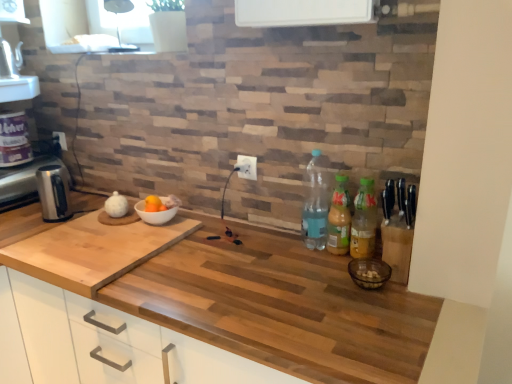
Question: From a real-world perspective, is white plastic electric outlet at upper center, the 1th electric outlet positioned from the left, physically above white plastic electric outlet at center, the second electric outlet positioned from the left?

Choices:
 (A) no
 (B) yes

Answer: (A)

Question: Does white plastic electric outlet at upper center, which is the second electric outlet from right to left, have a lesser width compared to white plastic electric outlet at center, the second electric outlet positioned from the back?

Choices:
 (A) yes
 (B) no

Answer: (B)

Question: Is white plastic electric outlet at upper center, the 1th electric outlet positioned from the left, shorter than white plastic electric outlet at center, the second electric outlet positioned from the left?

Choices:
 (A) yes
 (B) no

Answer: (A)

Question: From the image's perspective, is white plastic electric outlet at upper center, marked as the first electric outlet in a back-to-front arrangement, on white plastic electric outlet at center, arranged as the first electric outlet when viewed from the right?

Choices:
 (A) no
 (B) yes

Answer: (B)

Question: Is white plastic electric outlet at upper center, which is the second electric outlet from right to left, touching white plastic electric outlet at center, which is the second electric outlet from top to bottom?

Choices:
 (A) no
 (B) yes

Answer: (A)

Question: Considering the positions of translucent plastic bottle at right, which is the third bottle in right-to-left order, and satin silver kettle at left in the image, is translucent plastic bottle at right, which is the third bottle in right-to-left order, bigger or smaller than satin silver kettle at left?

Choices:
 (A) small
 (B) big

Answer: (A)

Question: Considering the relative positions of translucent plastic bottle at right, which ranks as the 1th bottle in left-to-right order, and satin silver kettle at left in the image provided, is translucent plastic bottle at right, which ranks as the 1th bottle in left-to-right order, to the left or to the right of satin silver kettle at left?

Choices:
 (A) right
 (B) left

Answer: (A)

Question: Is translucent plastic bottle at right, which ranks as the 1th bottle in left-to-right order, taller or shorter than satin silver kettle at left?

Choices:
 (A) tall
 (B) short

Answer: (A)

Question: From a real-world perspective, is translucent plastic bottle at right, which ranks as the 1th bottle in left-to-right order, positioned above or below satin silver kettle at left?

Choices:
 (A) below
 (B) above

Answer: (B)

Question: From the image's perspective, is satin silver kettle at left above or below satin silver kettle at left?

Choices:
 (A) above
 (B) below

Answer: (A)

Question: In terms of width, does satin silver kettle at left look wider or thinner when compared to satin silver kettle at left?

Choices:
 (A) thin
 (B) wide

Answer: (B)

Question: Is satin silver kettle at left to the left or to the right of satin silver kettle at left in the image?

Choices:
 (A) right
 (B) left

Answer: (B)

Question: In the image, is satin silver kettle at left positioned in front of or behind satin silver kettle at left?

Choices:
 (A) behind
 (B) front

Answer: (A)

Question: Considering their positions, is translucent plastic bottles at right, which is the 2th bottle in left-to-right order, located in front of or behind satin silver kettle at left?

Choices:
 (A) front
 (B) behind

Answer: (A)

Question: From a real-world perspective, is translucent plastic bottles at right, which is the 2th bottle in left-to-right order, physically located above or below satin silver kettle at left?

Choices:
 (A) above
 (B) below

Answer: (A)